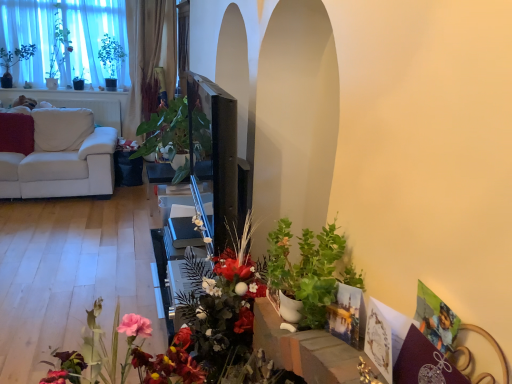
What do you see at coordinates (222, 304) in the screenshot?
I see `matte floral arrangement at center` at bounding box center [222, 304].

Locate an element on the screen. This screenshot has height=384, width=512. white fabric couch at left is located at coordinates (62, 169).

Is green glossy plant at center, which is the first houseplant in left-to-right order, aimed at matte floral arrangement at center?

No, green glossy plant at center, which is the first houseplant in left-to-right order, is not turned towards matte floral arrangement at center.

Which of these two, green glossy plant at center, the second houseplant viewed from the front, or matte floral arrangement at center, stands taller?

With more height is matte floral arrangement at center.

Which of these two, green glossy plant at center, which is the 1th houseplant in top-to-bottom order, or matte floral arrangement at center, is thinner?

Thinner between the two is matte floral arrangement at center.

From the image's perspective, is green glossy plant at center, the second houseplant viewed from the front, below matte floral arrangement at center?

No, from the image's perspective, green glossy plant at center, the second houseplant viewed from the front, is not beneath matte floral arrangement at center.

From the image's perspective, between green matte plant at lower right, positioned as the 1th houseplant in front-to-back order, and matte floral arrangement at center, who is located below?

From the image's view, matte floral arrangement at center is below.

What are the coordinates of `floral arrangement that is under the green matte plant at lower right, which is the first houseplant from bottom to top (from a real-world perspective)` in the screenshot? It's located at (222, 304).

Considering the relative sizes of green matte plant at lower right, which appears as the 1th houseplant when viewed from the right, and matte floral arrangement at center in the image provided, is green matte plant at lower right, which appears as the 1th houseplant when viewed from the right, shorter than matte floral arrangement at center?

Yes, green matte plant at lower right, which appears as the 1th houseplant when viewed from the right, is shorter than matte floral arrangement at center.

Is point (317, 283) positioned after point (245, 240)?

No.

Which point is more distant from viewer, (x=218, y=297) or (x=271, y=242)?

Point (x=218, y=297)

Considering the relative positions of matte floral arrangement at center and green matte plant at lower right, which is the first houseplant from bottom to top, in the image provided, is matte floral arrangement at center to the right of green matte plant at lower right, which is the first houseplant from bottom to top, from the viewer's perspective?

No, matte floral arrangement at center is not to the right of green matte plant at lower right, which is the first houseplant from bottom to top.

Is matte floral arrangement at center positioned with its back to green matte plant at lower right, which appears as the 1th houseplant when viewed from the right?

No, matte floral arrangement at center is not facing the opposite direction of green matte plant at lower right, which appears as the 1th houseplant when viewed from the right.

Locate an element on the screen. This screenshot has width=512, height=384. the 1st houseplant positioned above the matte floral arrangement at center (from the image's perspective) is located at coordinates (x=309, y=270).

From a real-world perspective, is matte floral arrangement at center beneath white fabric couch at left?

No, from a real-world perspective, matte floral arrangement at center is not beneath white fabric couch at left.

What's the angular difference between matte floral arrangement at center and white fabric couch at left's facing directions?

The angle between the facing direction of matte floral arrangement at center and the facing direction of white fabric couch at left is 89.1 degrees.

Is matte floral arrangement at center looking in the opposite direction of white fabric couch at left?

No, matte floral arrangement at center is not facing away from white fabric couch at left.

Is matte floral arrangement at center next to white fabric couch at left and touching it?

No, matte floral arrangement at center is not making contact with white fabric couch at left.

Considering the relative sizes of green glossy plant at center, which ranks as the 2th houseplant in bottom-to-top order, and green matte plant at lower right, which appears as the 1th houseplant when viewed from the right, in the image provided, is green glossy plant at center, which ranks as the 2th houseplant in bottom-to-top order, shorter than green matte plant at lower right, which appears as the 1th houseplant when viewed from the right,?

No, green glossy plant at center, which ranks as the 2th houseplant in bottom-to-top order, is not shorter than green matte plant at lower right, which appears as the 1th houseplant when viewed from the right.

In the scene shown: Based on their sizes in the image, would you say green glossy plant at center, the second houseplant viewed from the front, is bigger or smaller than green matte plant at lower right, which appears as the 1th houseplant when viewed from the right?

Considering their sizes, green glossy plant at center, the second houseplant viewed from the front, takes up more space than green matte plant at lower right, which appears as the 1th houseplant when viewed from the right.

Does green glossy plant at center, the second houseplant viewed from the front, have a lesser width compared to green matte plant at lower right, marked as the second houseplant in a left-to-right arrangement?

No, green glossy plant at center, the second houseplant viewed from the front, is not thinner than green matte plant at lower right, marked as the second houseplant in a left-to-right arrangement.

Is green glossy plant at center, which ranks as the 2th houseplant in bottom-to-top order, in front of green matte plant at lower right, which is the first houseplant from bottom to top?

No, it is behind green matte plant at lower right, which is the first houseplant from bottom to top.

Considering the sizes of objects green matte plant at lower right, positioned as the second houseplant in top-to-bottom order, and green matte plant at upper left in the image provided, who is taller, green matte plant at lower right, positioned as the second houseplant in top-to-bottom order, or green matte plant at upper left?

green matte plant at upper left is taller.

You are a GUI agent. You are given a task and a screenshot of the screen. Output one action in this format:
    pyautogui.click(x=<x>, y=<y>)
    Task: Click on the bouquet behind the green matte plant at lower right, positioned as the second houseplant in top-to-bottom order
    
    Given the screenshot: What is the action you would take?
    pyautogui.click(x=58, y=48)

Is the surface of green matte plant at lower right, which is the first houseplant from bottom to top, in direct contact with green matte plant at upper left?

green matte plant at lower right, which is the first houseplant from bottom to top, is not next to green matte plant at upper left, and they're not touching.

How far apart are green matte plant at lower right, positioned as the 1th houseplant in front-to-back order, and green matte plant at upper left?

The distance of green matte plant at lower right, positioned as the 1th houseplant in front-to-back order, from green matte plant at upper left is 5.65 meters.

From the image's perspective, which one is positioned lower, green matte plant at upper left or matte floral arrangement at center?

matte floral arrangement at center appears lower in the image.

Is matte floral arrangement at center at the back of green matte plant at upper left?

green matte plant at upper left is not turned away from matte floral arrangement at center.

Looking at this image, which is behind, green matte plant at upper left or matte floral arrangement at center?

green matte plant at upper left is more distant.

You are a GUI agent. You are given a task and a screenshot of the screen. Output one action in this format:
    pyautogui.click(x=<x>, y=<y>)
    Task: Click on the 1st houseplant directly above the matte floral arrangement at center (from a real-world perspective)
    The image size is (512, 384).
    Given the screenshot: What is the action you would take?
    pyautogui.click(x=166, y=130)

Find the location of a particular element. houseplant that is the 1st object located above the matte floral arrangement at center (from the image's perspective) is located at coordinates (309, 270).

Considering their positions, is white fabric couch at left positioned closer to green matte plant at upper left than green matte plant at lower right, which is the first houseplant from bottom to top?

white fabric couch at left is positioned closer to the anchor green matte plant at upper left.

Based on their spatial positions, is green matte plant at upper left or green glossy plant at center, which ranks as the 2th houseplant in bottom-to-top order, closer to matte floral arrangement at center?

Based on the image, green glossy plant at center, which ranks as the 2th houseplant in bottom-to-top order, appears to be nearer to matte floral arrangement at center.

Estimate the real-world distances between objects in this image. Which object is closer to matte floral arrangement at center, green matte plant at lower right, which is the first houseplant from bottom to top, or green glossy plant at center, which is the first houseplant in left-to-right order?

The object closer to matte floral arrangement at center is green matte plant at lower right, which is the first houseplant from bottom to top.

Which object lies nearer to the anchor point green matte plant at lower right, which appears as the 1th houseplant when viewed from the right, green glossy plant at center, the first houseplant viewed from the back, or white fabric couch at left?

green glossy plant at center, the first houseplant viewed from the back.

Based on their spatial positions, is green glossy plant at center, positioned as the second houseplant in right-to-left order, or green matte plant at upper left further from matte floral arrangement at center?

Based on the image, green matte plant at upper left appears to be further to matte floral arrangement at center.

Estimate the real-world distances between objects in this image. Which object is further from green matte plant at lower right, positioned as the 1th houseplant in front-to-back order, green glossy plant at center, the second houseplant viewed from the front, or green matte plant at upper left?

Among the two, green matte plant at upper left is located further to green matte plant at lower right, positioned as the 1th houseplant in front-to-back order.

Considering their positions, is white fabric couch at left positioned further to green matte plant at lower right, which is the first houseplant from bottom to top, than green matte plant at upper left?

Based on the image, green matte plant at upper left appears to be further to green matte plant at lower right, which is the first houseplant from bottom to top.

Looking at the image, which one is located further to green matte plant at upper left, matte floral arrangement at center or white fabric couch at left?

matte floral arrangement at center.

I want to click on houseplant between matte floral arrangement at center and white fabric couch at left in the front-back direction, so click(x=166, y=130).

Identify the location of studio couch positioned between green glossy plant at center, which ranks as the 2th houseplant in bottom-to-top order, and green matte plant at upper left from near to far. This screenshot has height=384, width=512. (62, 169).

I want to click on houseplant positioned between matte floral arrangement at center and green matte plant at upper left from near to far, so click(166, 130).

In order to click on studio couch between green matte plant at lower right, arranged as the second houseplant when viewed from the back, and green matte plant at upper left in the front-back direction in this screenshot , I will do `click(62, 169)`.